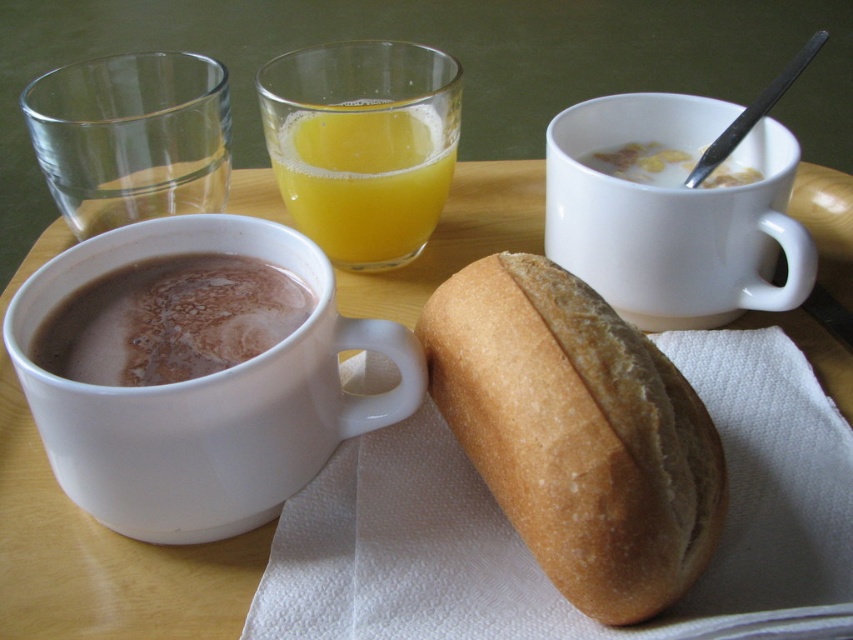
Question: Is golden brown crusty bread at center below white glossy mug at upper center?

Choices:
 (A) no
 (B) yes

Answer: (B)

Question: Which object is farther from the camera taking this photo?

Choices:
 (A) white glossy mug at upper center
 (B) brown matte mug at lower left

Answer: (A)

Question: Does golden brown crusty bread at center have a lesser width compared to translucent glass orange juice at center?

Choices:
 (A) no
 (B) yes

Answer: (A)

Question: Which of the following is the closest to the observer?

Choices:
 (A) (136, 323)
 (B) (793, 305)

Answer: (A)

Question: In this image, where is white glossy mug at left located relative to brown matte mug at lower left?

Choices:
 (A) right
 (B) left

Answer: (A)

Question: Which point is closer to the camera taking this photo?

Choices:
 (A) (142, 346)
 (B) (364, 237)
 (C) (323, 449)
 (D) (550, 170)

Answer: (A)